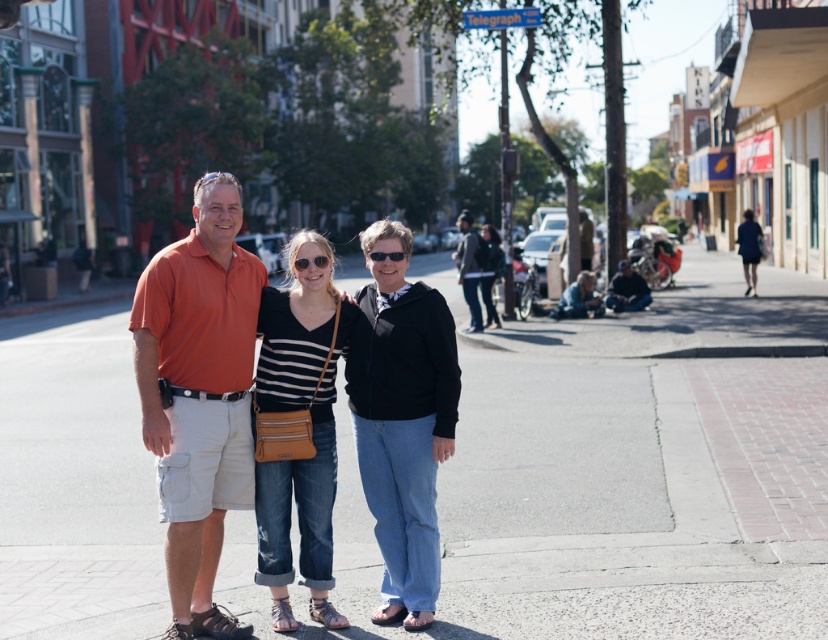
Is concrete at center smaller than dark gray hoodie at center?

No, concrete at center is not smaller than dark gray hoodie at center.

Which is above, concrete at center or dark gray hoodie at center?

dark gray hoodie at center is above.

Which is in front, point (585, 320) or point (477, 272)?

Point (477, 272) is in front.

Image resolution: width=828 pixels, height=640 pixels. What are the coordinates of `concrete at center` in the screenshot? It's located at (643, 468).

Describe the element at coordinates (200, 392) in the screenshot. I see `orange cotton shirt at left` at that location.

Who is more forward, (224, 396) or (468, 236)?

Point (224, 396)

Is point (195, 426) positioned before point (485, 246)?

Yes, it is.

I want to click on orange cotton shirt at left, so click(200, 392).

Between striped cotton shirt at center and dark gray hoodie at center, which one appears on the left side from the viewer's perspective?

From the viewer's perspective, striped cotton shirt at center appears more on the left side.

Consider the image. Who is lower down, striped cotton shirt at center or dark gray hoodie at center?

striped cotton shirt at center

I want to click on striped cotton shirt at center, so click(x=310, y=428).